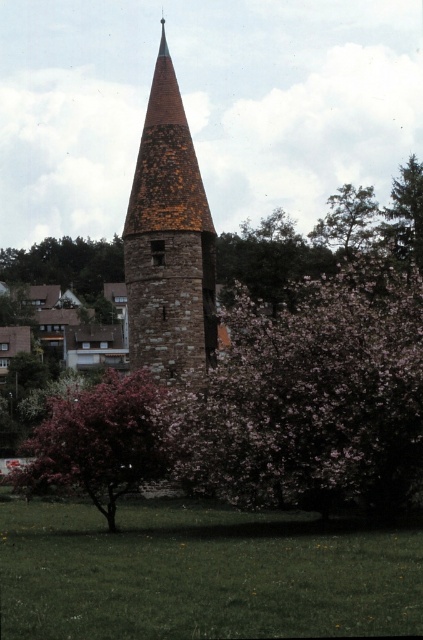
Can you confirm if green grass at center is smaller than brown stone tower at center?

No, green grass at center is not smaller than brown stone tower at center.

Which is above, green grass at center or brown stone tower at center?

Positioned higher is brown stone tower at center.

Is point (16, 624) less distant than point (150, 129)?

Yes.

Where is `green grass at center`? green grass at center is located at coordinates (203, 573).

Does pink bloom at center appear over brown stone tower at center?

No, pink bloom at center is not above brown stone tower at center.

Is pink bloom at center taller than brown stone tower at center?

No, pink bloom at center is not taller than brown stone tower at center.

Describe the element at coordinates (310, 397) in the screenshot. Image resolution: width=423 pixels, height=640 pixels. I see `pink bloom at center` at that location.

The width and height of the screenshot is (423, 640). In order to click on pink bloom at center in this screenshot , I will do click(x=310, y=397).

Is point (71, 464) in front of point (351, 188)?

Yes, point (71, 464) is in front of point (351, 188).

From the picture: Between pink blossoming tree at center and green leafy tree at upper center, which one is positioned higher?

green leafy tree at upper center

Which is in front, point (126, 422) or point (318, 227)?

Point (126, 422) is in front.

Locate an element on the screen. pink blossoming tree at center is located at coordinates (101, 442).